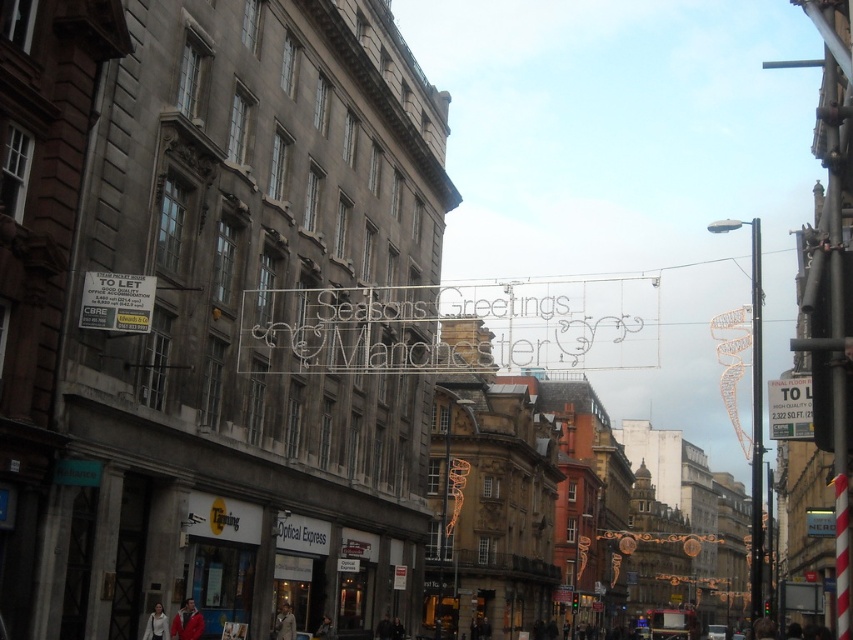
Can you confirm if white paper sign at center is positioned to the right of light beige coat at center?

Correct, you'll find white paper sign at center to the right of light beige coat at center.

What do you see at coordinates (790, 408) in the screenshot? I see `white paper sign at center` at bounding box center [790, 408].

Is point (769, 419) farther from viewer compared to point (283, 632)?

No, it is not.

The width and height of the screenshot is (853, 640). I want to click on white paper sign at center, so click(790, 408).

Is white paper sign at left closer to the viewer compared to light beige coat at center?

Yes.

Does white paper sign at left appear on the right side of light beige coat at center?

No, white paper sign at left is not to the right of light beige coat at center.

Who is more forward, (x=86, y=292) or (x=293, y=636)?

Point (x=86, y=292)

The width and height of the screenshot is (853, 640). In order to click on white paper sign at left in this screenshot , I will do `click(117, 301)`.

Does white paper sign at left come in front of red fabric jacket at lower left?

Yes, it is in front of red fabric jacket at lower left.

The image size is (853, 640). In order to click on white paper sign at left in this screenshot , I will do `click(117, 301)`.

Find the location of `white paper sign at left`. white paper sign at left is located at coordinates (117, 301).